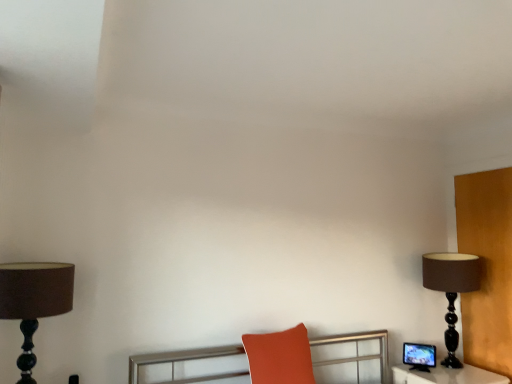
What do you see at coordinates (451, 289) in the screenshot?
I see `brown matte lamp at right, which ranks as the 1th lamp in back-to-front order` at bounding box center [451, 289].

The image size is (512, 384). What are the coordinates of `matte orange cushion at center` in the screenshot? It's located at (x=279, y=357).

Where is `brown fabric lampshade at left, marked as the first lamp in a left-to-right arrangement`? The image size is (512, 384). brown fabric lampshade at left, marked as the first lamp in a left-to-right arrangement is located at coordinates (34, 301).

At what (x,y) coordinates should I click in order to perform the action: click on brown matte lamp at right, placed as the 2th lamp when sorted from front to back. Please return your answer as a coordinate pair (x, y). This screenshot has height=384, width=512. Looking at the image, I should click on (451, 289).

Considering the sizes of brown fabric lampshade at left, which ranks as the 2th lamp in right-to-left order, and matte orange cushion at center in the image, is brown fabric lampshade at left, which ranks as the 2th lamp in right-to-left order, taller or shorter than matte orange cushion at center?

In the image, brown fabric lampshade at left, which ranks as the 2th lamp in right-to-left order, appears to be taller than matte orange cushion at center.

Where is `swivel chair behind the brown fabric lampshade at left, placed as the 1th lamp when sorted from front to back`? This screenshot has height=384, width=512. swivel chair behind the brown fabric lampshade at left, placed as the 1th lamp when sorted from front to back is located at coordinates (279, 357).

Which is behind, brown fabric lampshade at left, marked as the first lamp in a left-to-right arrangement, or matte orange cushion at center?

matte orange cushion at center is further from the camera.

In the scene shown: From the image's perspective, is brown fabric lampshade at left, marked as the first lamp in a left-to-right arrangement, located beneath matte orange cushion at center?

No, from the image's perspective, brown fabric lampshade at left, marked as the first lamp in a left-to-right arrangement, is not beneath matte orange cushion at center.

Is point (252, 362) positioned behind point (417, 359)?

No, (252, 362) is closer to viewer.

Is matte orange cushion at center positioned with its back to matte black monitor at right?

matte orange cushion at center is not turned away from matte black monitor at right.

How different are the orientations of matte orange cushion at center and matte black monitor at right in degrees?

The angular difference between matte orange cushion at center and matte black monitor at right is 53.3 degrees.

Locate an element on the screen. swivel chair that appears below the brown fabric lampshade at left, marked as the first lamp in a left-to-right arrangement (from a real-world perspective) is located at coordinates (279, 357).

Which is more to the left, matte orange cushion at center or brown fabric lampshade at left, positioned as the 2th lamp in back-to-front order?

Positioned to the left is brown fabric lampshade at left, positioned as the 2th lamp in back-to-front order.

Can you confirm if matte orange cushion at center is bigger than brown fabric lampshade at left, which ranks as the 2th lamp in right-to-left order?

No.

Is matte orange cushion at center turned away from brown fabric lampshade at left, marked as the first lamp in a left-to-right arrangement?

That's not correct — matte orange cushion at center is not looking away from brown fabric lampshade at left, marked as the first lamp in a left-to-right arrangement.

From a real-world perspective, is matte black monitor at right beneath brown matte lamp at right, the first lamp when ordered from right to left?

Yes, from a real-world perspective, matte black monitor at right is under brown matte lamp at right, the first lamp when ordered from right to left.

Is matte black monitor at right positioned with its back to brown matte lamp at right, which ranks as the 1th lamp in back-to-front order?

Absolutely, matte black monitor at right is directed away from brown matte lamp at right, which ranks as the 1th lamp in back-to-front order.

Does matte black monitor at right have a greater width compared to brown matte lamp at right, which ranks as the 1th lamp in back-to-front order?

Incorrect, the width of matte black monitor at right does not surpass that of brown matte lamp at right, which ranks as the 1th lamp in back-to-front order.

Is matte black monitor at right outside of brown matte lamp at right, which ranks as the 1th lamp in back-to-front order?

Yes, matte black monitor at right is not within brown matte lamp at right, which ranks as the 1th lamp in back-to-front order.

In terms of width, does matte black monitor at right look wider or thinner when compared to brown fabric lampshade at left, marked as the first lamp in a left-to-right arrangement?

matte black monitor at right is thinner than brown fabric lampshade at left, marked as the first lamp in a left-to-right arrangement.

Could brown fabric lampshade at left, which ranks as the 2th lamp in right-to-left order, be considered to be inside matte black monitor at right?

That's incorrect, brown fabric lampshade at left, which ranks as the 2th lamp in right-to-left order, is not inside matte black monitor at right.

Is matte black monitor at right turned away from brown fabric lampshade at left, positioned as the 2th lamp in back-to-front order?

No, matte black monitor at right's orientation is not away from brown fabric lampshade at left, positioned as the 2th lamp in back-to-front order.

Could you measure the distance between matte orange cushion at center and brown matte lamp at right, which appears as the second lamp when viewed from the left?

The distance of matte orange cushion at center from brown matte lamp at right, which appears as the second lamp when viewed from the left, is 1.10 meters.

From a real-world perspective, which object rests below the other?

matte orange cushion at center, from a real-world perspective.

Who is smaller, matte orange cushion at center or brown matte lamp at right, placed as the 2th lamp when sorted from front to back?

matte orange cushion at center is smaller.

From the image's perspective, is matte orange cushion at center above or below brown matte lamp at right, placed as the 2th lamp when sorted from front to back?

Clearly, from the image's perspective, matte orange cushion at center is below brown matte lamp at right, placed as the 2th lamp when sorted from front to back.

Is brown fabric lampshade at left, which ranks as the 2th lamp in right-to-left order, to the right of brown matte lamp at right, placed as the 2th lamp when sorted from front to back, from the viewer's perspective?

No.

Between point (56, 272) and point (442, 363), which one is positioned in front?

Positioned in front is point (56, 272).

How many degrees apart are the facing directions of brown fabric lampshade at left, placed as the 1th lamp when sorted from front to back, and brown matte lamp at right, which appears as the second lamp when viewed from the left?

The angle between the facing direction of brown fabric lampshade at left, placed as the 1th lamp when sorted from front to back, and the facing direction of brown matte lamp at right, which appears as the second lamp when viewed from the left, is 0.44 degrees.

I want to click on lamp that appears below the brown fabric lampshade at left, positioned as the 2th lamp in back-to-front order (from the image's perspective), so click(x=451, y=289).

Where is `the 2nd lamp above the matte orange cushion at center (from a real-world perspective)`? The width and height of the screenshot is (512, 384). the 2nd lamp above the matte orange cushion at center (from a real-world perspective) is located at coordinates (34, 301).

At what (x,y) coordinates should I click in order to perform the action: click on computer monitor that appears below the matte orange cushion at center (from the image's perspective). Please return your answer as a coordinate pair (x, y). Looking at the image, I should click on (419, 356).

Looking at the image, which one is located closer to brown fabric lampshade at left, marked as the first lamp in a left-to-right arrangement, matte black monitor at right or brown matte lamp at right, which ranks as the 1th lamp in back-to-front order?

The object closer to brown fabric lampshade at left, marked as the first lamp in a left-to-right arrangement, is matte black monitor at right.

Consider the image. From the image, which object appears to be farther from brown matte lamp at right, the first lamp when ordered from right to left, matte black monitor at right or brown fabric lampshade at left, positioned as the 2th lamp in back-to-front order?

The object further to brown matte lamp at right, the first lamp when ordered from right to left, is brown fabric lampshade at left, positioned as the 2th lamp in back-to-front order.

Based on their spatial positions, is brown matte lamp at right, which appears as the second lamp when viewed from the left, or brown fabric lampshade at left, which ranks as the 2th lamp in right-to-left order, closer to matte black monitor at right?

The object closer to matte black monitor at right is brown matte lamp at right, which appears as the second lamp when viewed from the left.

From the image, which object appears to be nearer to matte black monitor at right, matte orange cushion at center or brown fabric lampshade at left, marked as the first lamp in a left-to-right arrangement?

matte orange cushion at center.

Looking at the image, which one is located further to matte black monitor at right, brown matte lamp at right, the first lamp when ordered from right to left, or matte orange cushion at center?

matte orange cushion at center is positioned further to the anchor matte black monitor at right.

In the scene shown: Estimate the real-world distances between objects in this image. Which object is further from brown matte lamp at right, which appears as the second lamp when viewed from the left, brown fabric lampshade at left, which ranks as the 2th lamp in right-to-left order, or matte orange cushion at center?

brown fabric lampshade at left, which ranks as the 2th lamp in right-to-left order, is positioned further to the anchor brown matte lamp at right, which appears as the second lamp when viewed from the left.

From the image, which object appears to be farther from brown matte lamp at right, placed as the 2th lamp when sorted from front to back, matte black monitor at right or matte orange cushion at center?

matte orange cushion at center is further to brown matte lamp at right, placed as the 2th lamp when sorted from front to back.

Looking at the image, which one is located closer to brown fabric lampshade at left, marked as the first lamp in a left-to-right arrangement, matte orange cushion at center or matte black monitor at right?

matte orange cushion at center lies closer to brown fabric lampshade at left, marked as the first lamp in a left-to-right arrangement, than the other object.

The image size is (512, 384). What are the coordinates of `swivel chair between brown fabric lampshade at left, which ranks as the 2th lamp in right-to-left order, and matte black monitor at right, in the horizontal direction` in the screenshot? It's located at (279, 357).

Where is `computer monitor between brown fabric lampshade at left, which ranks as the 2th lamp in right-to-left order, and brown matte lamp at right, placed as the 2th lamp when sorted from front to back, in the horizontal direction`? The width and height of the screenshot is (512, 384). computer monitor between brown fabric lampshade at left, which ranks as the 2th lamp in right-to-left order, and brown matte lamp at right, placed as the 2th lamp when sorted from front to back, in the horizontal direction is located at coordinates (419, 356).

I want to click on computer monitor situated between matte orange cushion at center and brown matte lamp at right, which ranks as the 1th lamp in back-to-front order, from left to right, so click(419, 356).

The width and height of the screenshot is (512, 384). I want to click on swivel chair located between brown fabric lampshade at left, which ranks as the 2th lamp in right-to-left order, and brown matte lamp at right, which ranks as the 1th lamp in back-to-front order, in the left-right direction, so click(279, 357).